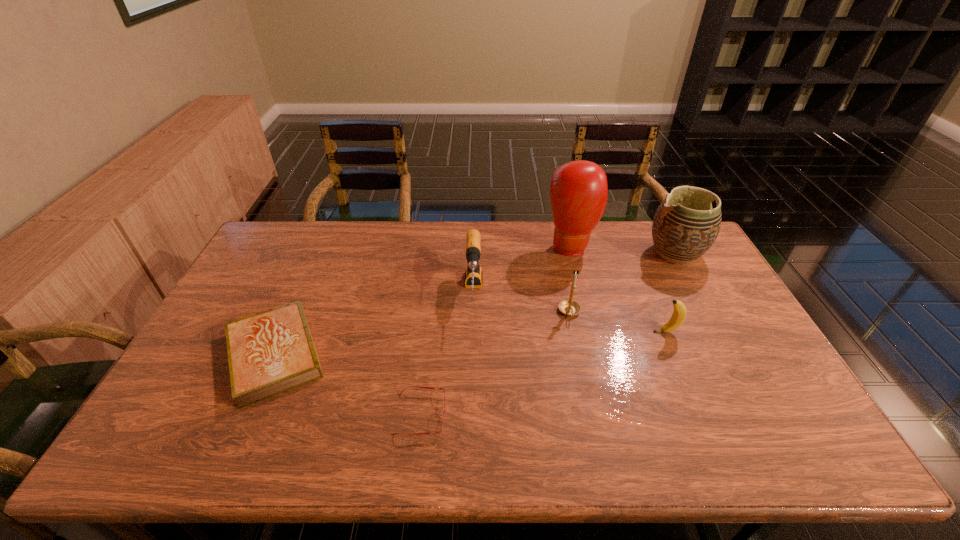
You are a GUI agent. You are given a task and a screenshot of the screen. Output one action in this format:
    pyautogui.click(x=<x>, y=<y>)
    Task: Click on the boxing glove
    
    Given the screenshot: What is the action you would take?
    (x=578, y=191)

This screenshot has height=540, width=960. Identify the location of the rightmost object. (685, 226).

Where is `the sixth shortest object`? the sixth shortest object is located at coordinates (685, 226).

This screenshot has height=540, width=960. What are the coordinates of `the third object from left to right` in the screenshot? It's located at (473, 275).

You are a GUI agent. You are given a task and a screenshot of the screen. Output one action in this format:
    pyautogui.click(x=<x>, y=<y>)
    Task: Click on the candle holder
    
    Given the screenshot: What is the action you would take?
    pyautogui.click(x=569, y=307)

Find the location of a particular element. This screenshot has width=960, height=540. banana is located at coordinates (679, 314).

Where is `the second object from right to left`? the second object from right to left is located at coordinates (679, 314).

At what (x,y) coordinates should I click in order to perform the action: click on the second shortest object. Please return your answer as a coordinate pair (x, y). Looking at the image, I should click on (269, 352).

The image size is (960, 540). I want to click on hardback book, so click(x=269, y=352).

Where is `the second object from left to right`? This screenshot has height=540, width=960. the second object from left to right is located at coordinates (410, 386).